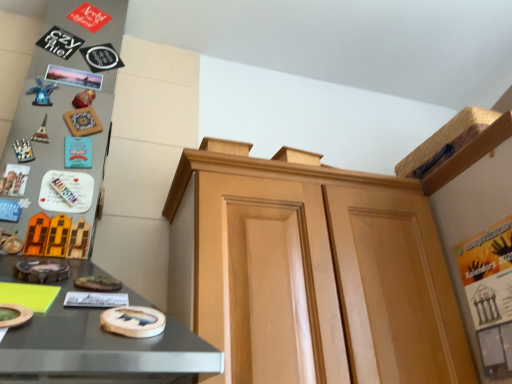
Question: In terms of height, does blue plastic windmill at left look taller or shorter compared to light brown wood cabinet at center?

Choices:
 (A) short
 (B) tall

Answer: (A)

Question: In terms of width, does blue plastic windmill at left look wider or thinner when compared to light brown wood cabinet at center?

Choices:
 (A) wide
 (B) thin

Answer: (B)

Question: Does point (52, 82) appear closer or farther from the camera than point (459, 326)?

Choices:
 (A) farther
 (B) closer

Answer: (A)

Question: From the image's perspective, is light brown wood cabinet at center above or below blue plastic windmill at left?

Choices:
 (A) below
 (B) above

Answer: (A)

Question: Is light brown wood cabinet at center inside or outside of blue plastic windmill at left?

Choices:
 (A) inside
 (B) outside

Answer: (B)

Question: In terms of width, does light brown wood cabinet at center look wider or thinner when compared to blue plastic windmill at left?

Choices:
 (A) wide
 (B) thin

Answer: (A)

Question: In the image, is light brown wood cabinet at center on the left side or the right side of blue plastic windmill at left?

Choices:
 (A) right
 (B) left

Answer: (A)